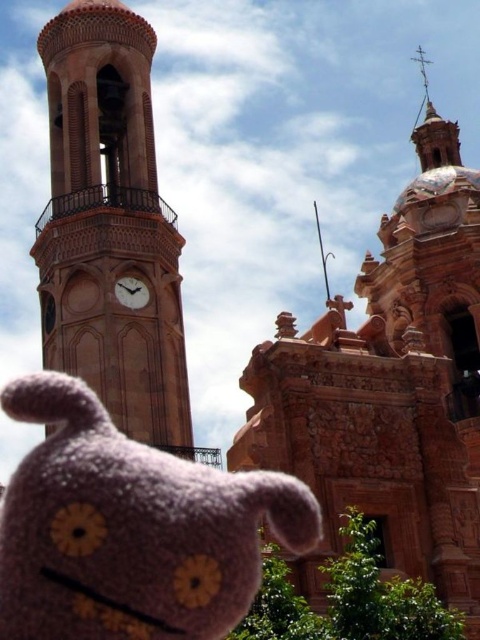
You are an architect analyzing the scale of structures in the image. Which structure occupies more visual space in the scene, the terracotta stone church at upper center or the brown stone clock tower at left?

The terracotta stone church at upper center is larger in size than the brown stone clock tower at left, so it occupies more visual space in the scene.

You are a drone operator who needs to fly a drone between the terracotta stone church at upper center and the brown stone clock tower at left. The drone has a maximum flight distance of 20 meters. Can the drone safely travel between them without exceeding its limit?

The terracotta stone church at upper center and brown stone clock tower at left are 19.27 meters apart from each other. Since the distance is under the drone maximum flight distance of 20 meters, the drone can safely travel between them without exceeding its limit.